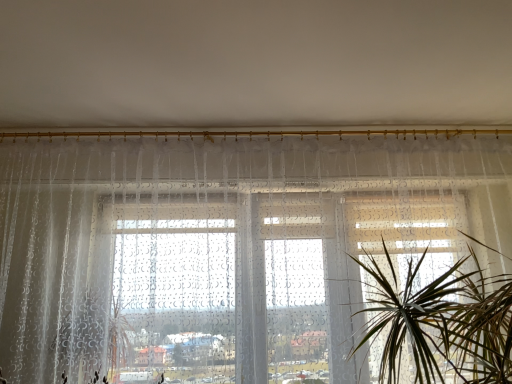
Question: Considering the relative positions of transparent fabric window at center and green leafy plant at center in the image provided, is transparent fabric window at center behind green leafy plant at center?

Choices:
 (A) no
 (B) yes

Answer: (B)

Question: Does transparent fabric window at center appear on the left side of green leafy plant at center?

Choices:
 (A) yes
 (B) no

Answer: (A)

Question: Is transparent fabric window at center surrounding green leafy plant at center?

Choices:
 (A) yes
 (B) no

Answer: (B)

Question: Could you tell me if transparent fabric window at center is facing green leafy plant at center?

Choices:
 (A) no
 (B) yes

Answer: (B)

Question: From the image's perspective, does transparent fabric window at center appear higher than green leafy plant at center?

Choices:
 (A) yes
 (B) no

Answer: (A)

Question: Would you consider transparent fabric window at center to be distant from green leafy plant at center?

Choices:
 (A) yes
 (B) no

Answer: (B)

Question: Considering the relative sizes of green leafy plant at center and transparent fabric window at center in the image provided, is green leafy plant at center shorter than transparent fabric window at center?

Choices:
 (A) no
 (B) yes

Answer: (B)

Question: Is green leafy plant at center wider than transparent fabric window at center?

Choices:
 (A) no
 (B) yes

Answer: (B)

Question: Considering the relative sizes of green leafy plant at center and transparent fabric window at center in the image provided, is green leafy plant at center bigger than transparent fabric window at center?

Choices:
 (A) no
 (B) yes

Answer: (A)

Question: Is green leafy plant at center not near transparent fabric window at center?

Choices:
 (A) yes
 (B) no

Answer: (B)

Question: From a real-world perspective, is green leafy plant at center on transparent fabric window at center?

Choices:
 (A) no
 (B) yes

Answer: (A)

Question: Is green leafy plant at center surrounding transparent fabric window at center?

Choices:
 (A) yes
 (B) no

Answer: (B)

Question: From the image's perspective, is green leafy plant at center above or below transparent fabric window at center?

Choices:
 (A) above
 (B) below

Answer: (B)